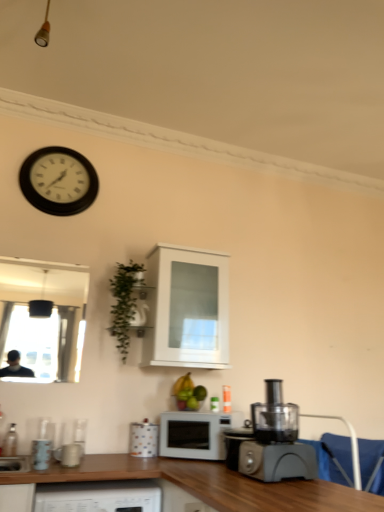
Question: From the image's perspective, is blue fabric armchair at lower right positioned above or below matte ceramic mug at lower left, the 1th appliance viewed from the left?

Choices:
 (A) below
 (B) above

Answer: (A)

Question: Relative to matte ceramic mug at lower left, the second appliance from the back, is blue fabric armchair at lower right in front or behind?

Choices:
 (A) behind
 (B) front

Answer: (A)

Question: Which is nearer to the black plastic clock at upper left?

Choices:
 (A) white matte microwave at center
 (B) green leafy plant at upper left
 (C) clear glass bottle at lower left
 (D) blue fabric armchair at lower right
 (E) black plastic food processor at lower right

Answer: (B)

Question: Estimate the real-world distances between objects in this image. Which object is farther from the polka dot ceramic mug at lower center, the second appliance when ordered from left to right?

Choices:
 (A) matte ceramic mug at lower left, which ranks as the 1th appliance in front-to-back order
 (B) clear glass bottle at lower left
 (C) black plastic clock at upper left
 (D) blue fabric armchair at lower right
 (E) white matte microwave at center

Answer: (C)